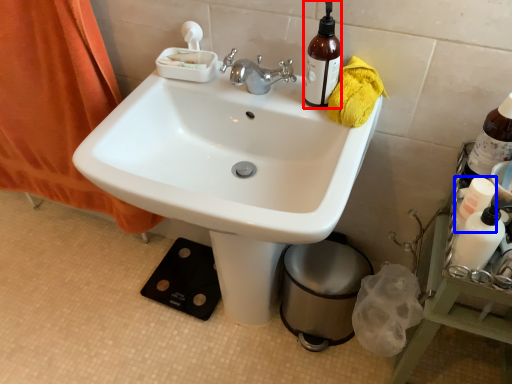
Question: Which of the following is the farthest to the observer, bottle (highlighted by a red box) or bottle (highlighted by a blue box)?

Choices:
 (A) bottle
 (B) bottle

Answer: (A)